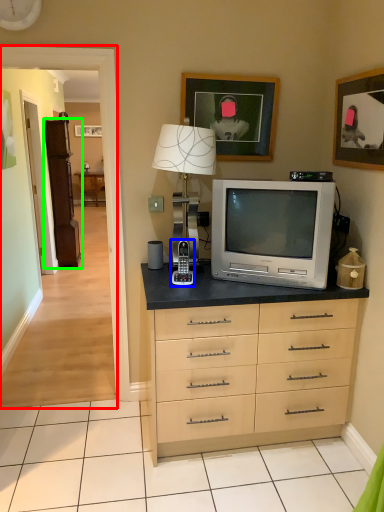
Question: Which object is the farthest from corridor (highlighted by a red box)? Choose among these: appliance (highlighted by a blue box) or armoire (highlighted by a green box).

Choices:
 (A) appliance
 (B) armoire

Answer: (B)